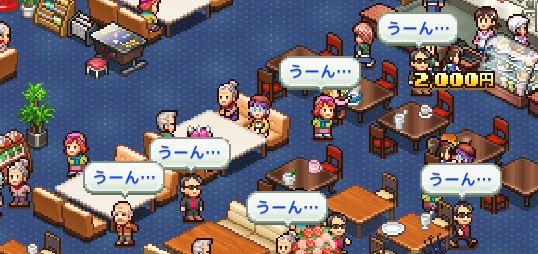
Image resolution: width=538 pixels, height=254 pixels. Find the location of `pot`. pot is located at coordinates (46, 143).